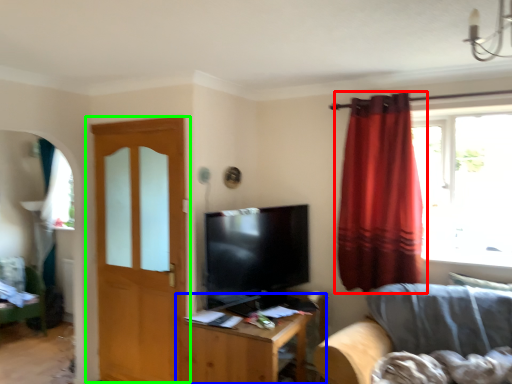
Question: Which object is positioned farthest from curtain (highlighted by a red box)? Select from table (highlighted by a blue box) and door (highlighted by a green box).

Choices:
 (A) table
 (B) door

Answer: (B)